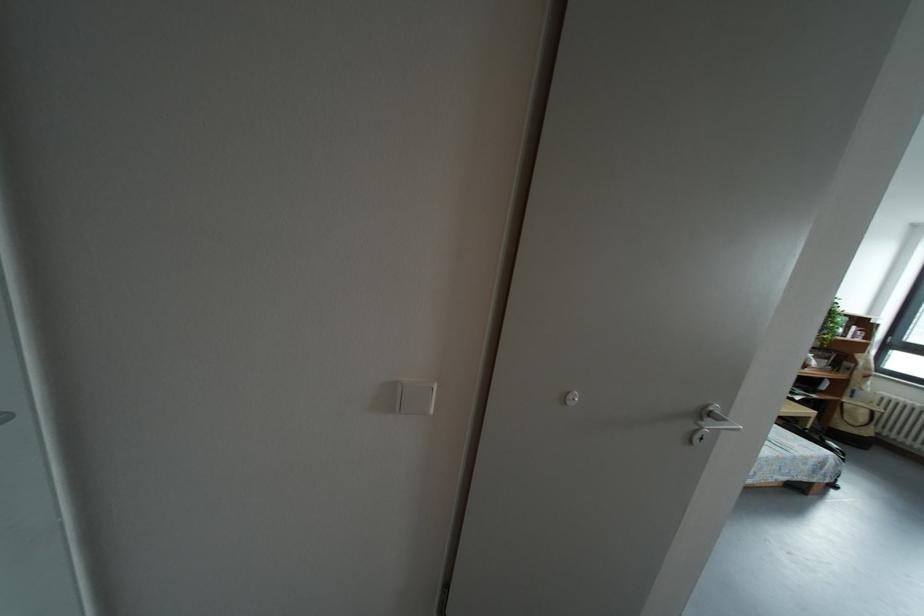
The width and height of the screenshot is (924, 616). What do you see at coordinates (415, 398) in the screenshot?
I see `a white light switch` at bounding box center [415, 398].